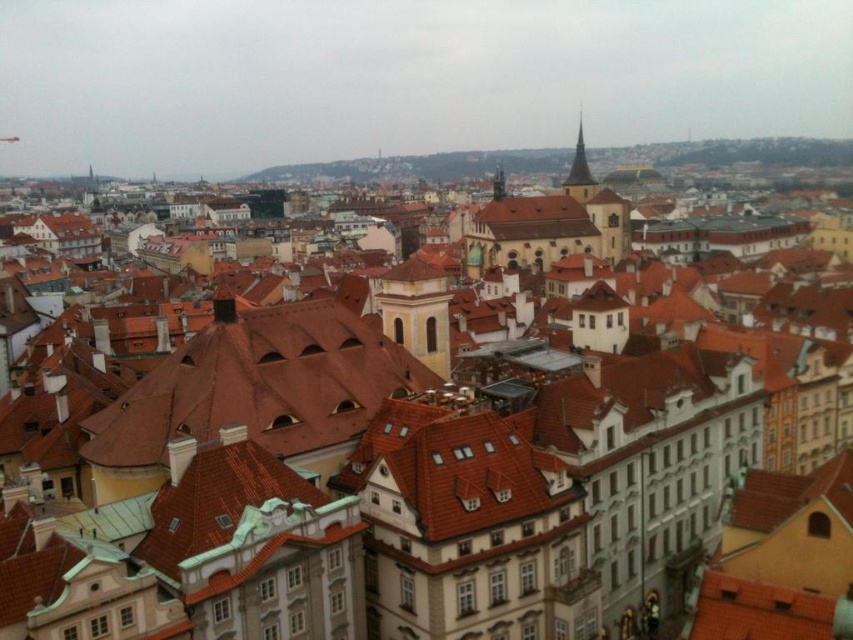
You are an architect analyzing the cityscape. You need to determine which of the two structures, the smooth stone spire at upper right or the smooth stone tower at center, has a greater width. Based on the scene, which one is wider?

The smooth stone spire at upper right is wider than the smooth stone tower at center.

You are an architect analyzing the cityscape. You need to determine which structure is taller between the smooth stone spire at upper right and the smooth stone tower at center. Based on the scene, which one is taller?

The smooth stone spire at upper right is taller than the smooth stone tower at center.